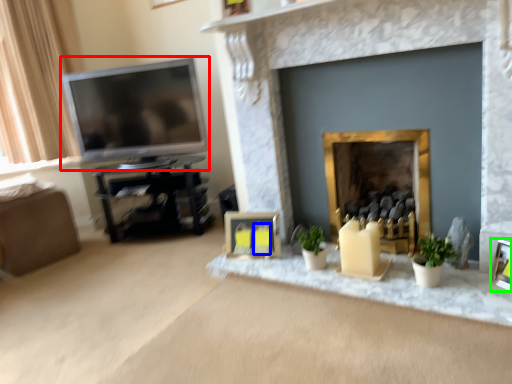
Question: Which object is positioned farthest from television (highlighted by a red box)? Select from candle (highlighted by a blue box) and picture frame (highlighted by a green box).

Choices:
 (A) candle
 (B) picture frame

Answer: (B)